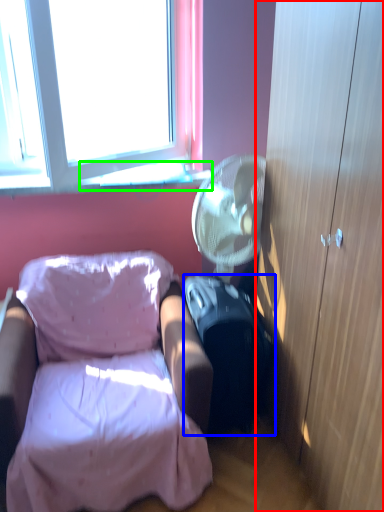
Question: Which is farther away from cabinetry (highlighted by a red box)? suitcase (highlighted by a blue box) or window sill (highlighted by a green box)?

Choices:
 (A) suitcase
 (B) window sill

Answer: (B)